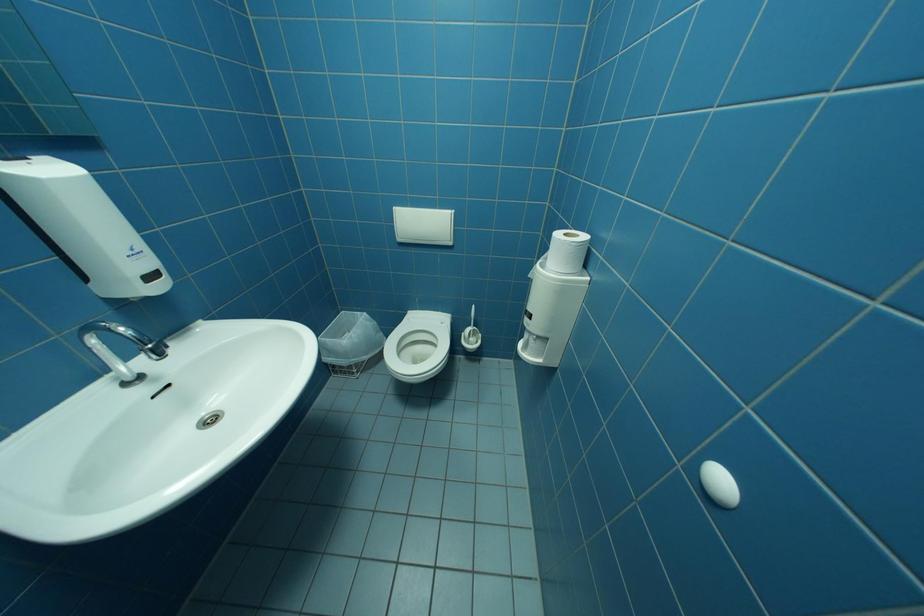
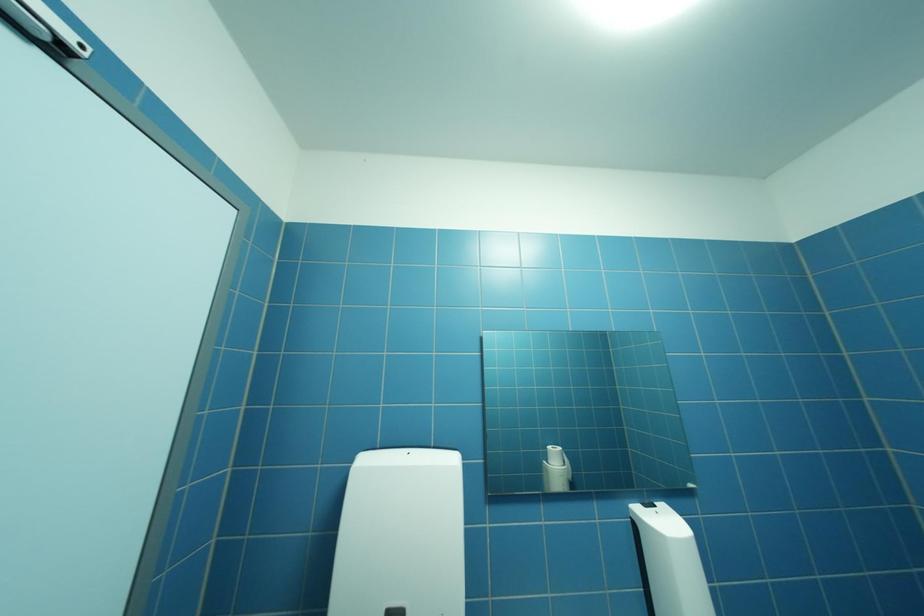
How did the camera likely rotate?

The rotation direction of the camera is left-up.